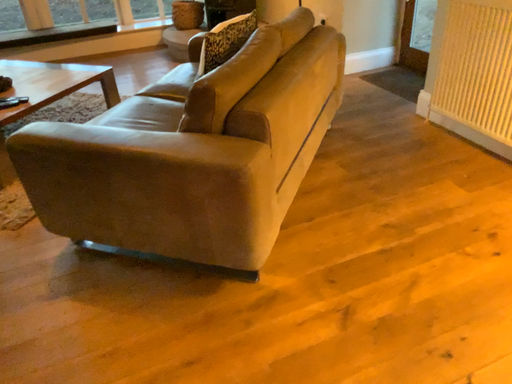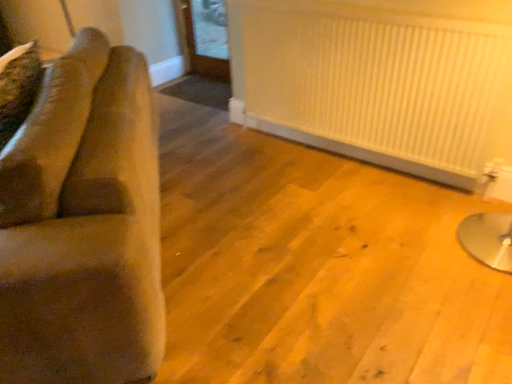
Question: Which way did the camera rotate in the video?

Choices:
 (A) rotated left
 (B) rotated right

Answer: (B)